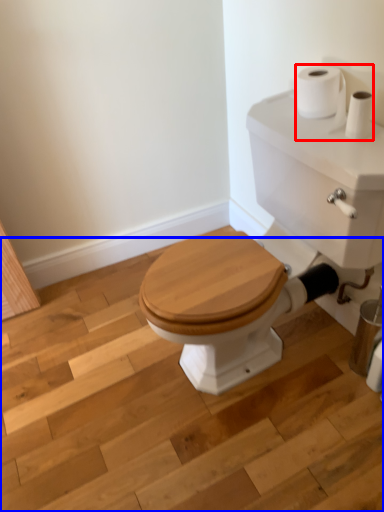
Question: Among these objects, which one is nearest to the camera, toilet paper (highlighted by a red box) or stair (highlighted by a blue box)?

Choices:
 (A) toilet paper
 (B) stair

Answer: (B)